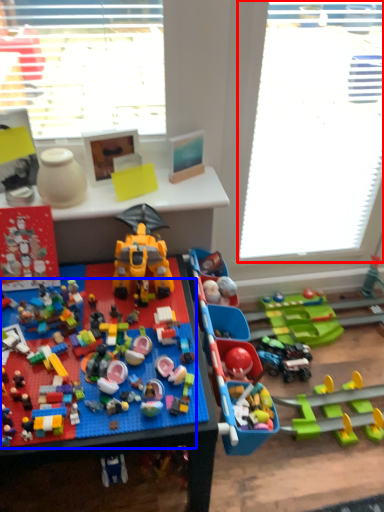
Question: Which object appears closest to the camera in this image, window screen (highlighted by a red box) or toy (highlighted by a blue box)?

Choices:
 (A) window screen
 (B) toy

Answer: (B)